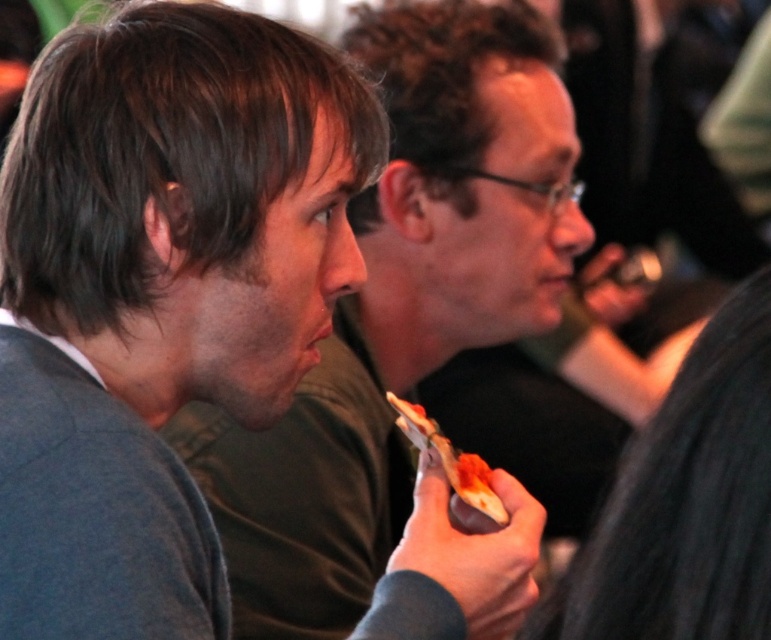
Does dark gray sweater at left come in front of tomato sauce pizza slice at center?

Yes, dark gray sweater at left is in front of tomato sauce pizza slice at center.

Can you confirm if dark gray sweater at left is thinner than tomato sauce pizza slice at center?

Incorrect, dark gray sweater at left's width is not less than tomato sauce pizza slice at center's.

Where is `dark gray sweater at left`? dark gray sweater at left is located at coordinates (162, 289).

Image resolution: width=771 pixels, height=640 pixels. Identify the location of dark gray sweater at left. (162, 289).

Is dark gray sweater at left thinner than dark gray textured shirt at right?

Incorrect, dark gray sweater at left's width is not less than dark gray textured shirt at right's.

How much distance is there between dark gray sweater at left and dark gray textured shirt at right?

They are 34.46 centimeters apart.

Identify the location of dark gray sweater at left. (162, 289).

Find the location of a particular element. The width and height of the screenshot is (771, 640). matte gray sweater at left is located at coordinates (399, 307).

Is point (362, 228) farther from viewer compared to point (746, 390)?

Yes, it is.

At what (x,y) coordinates should I click in order to perform the action: click on matte gray sweater at left. Please return your answer as a coordinate pair (x, y). Image resolution: width=771 pixels, height=640 pixels. Looking at the image, I should click on (399, 307).